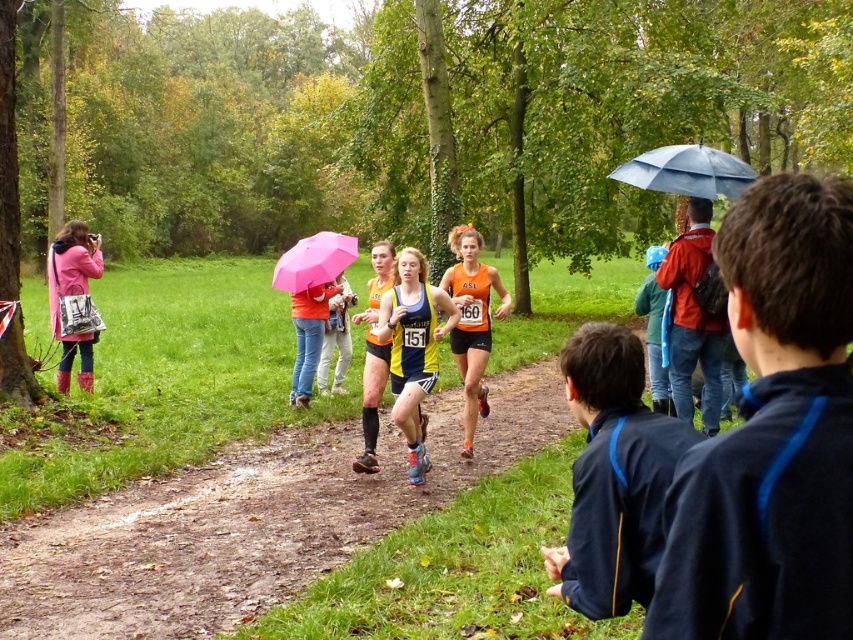
Question: Can you confirm if orange athletic shorts at center is positioned above pink matte umbrella at center?

Choices:
 (A) yes
 (B) no

Answer: (B)

Question: Is yellow and blue athletic suit at center below orange matte running suit at center?

Choices:
 (A) no
 (B) yes

Answer: (B)

Question: Among these objects, which one is farthest from the camera?

Choices:
 (A) orange matte running suit at center
 (B) pink matte umbrella at center
 (C) orange athletic shorts at center
 (D) blue fabric umbrella at upper right

Answer: (B)

Question: Which point is closer to the camera taking this photo?

Choices:
 (A) (427, 369)
 (B) (80, 225)
 (C) (128, 532)
 (D) (612, 170)

Answer: (C)

Question: Which object is positioned farthest from the dirt path at center?

Choices:
 (A) pink fabric camera at left
 (B) pink matte umbrella at center
 (C) orange athletic shorts at center
 (D) blue fabric umbrella at upper right

Answer: (A)

Question: Is blue fabric umbrella at upper right positioned at the back of orange athletic shorts at center?

Choices:
 (A) yes
 (B) no

Answer: (B)